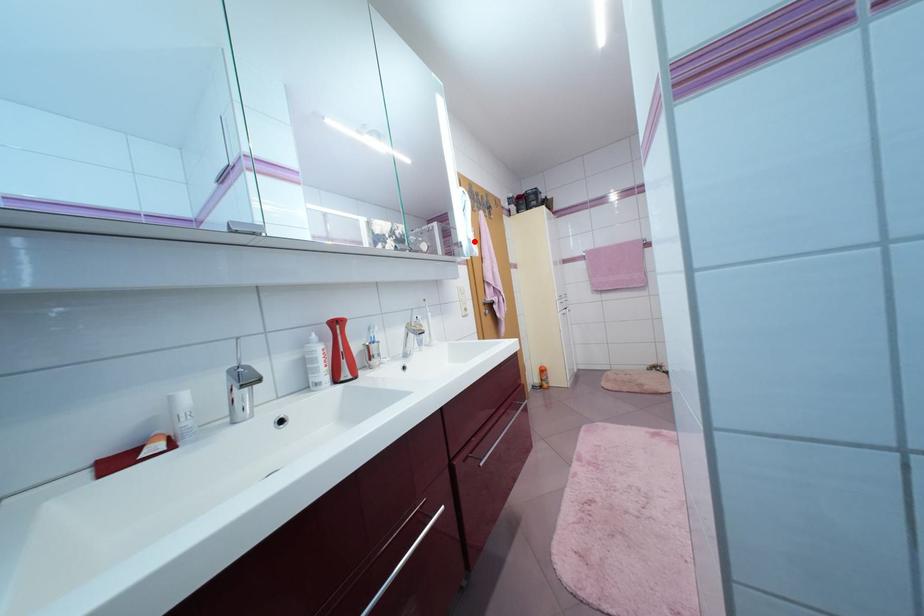
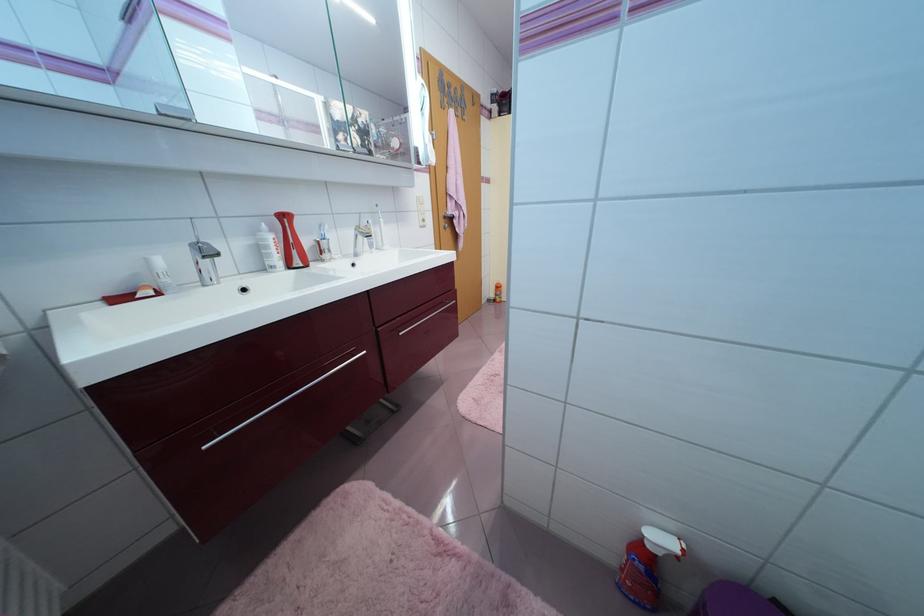
Question: I am providing you with two images of the same scene from different viewpoints. A red point is marked on the first image. At the location where the point appears in image 1, is it still visible in image 2?

Choices:
 (A) Yes
 (B) No

Answer: (A)